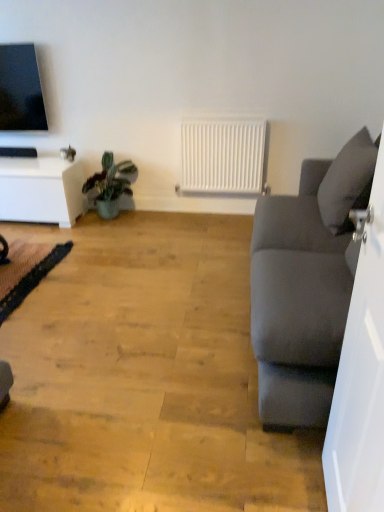
What do you see at coordinates (41, 190) in the screenshot?
I see `white glossy table at left` at bounding box center [41, 190].

What do you see at coordinates (348, 182) in the screenshot? This screenshot has height=512, width=384. I see `gray fabric pillow at right` at bounding box center [348, 182].

What do you see at coordinates (26, 271) in the screenshot? I see `black lace yoga mat at lower left` at bounding box center [26, 271].

Image resolution: width=384 pixels, height=512 pixels. What do you see at coordinates (305, 285) in the screenshot?
I see `matte gray couch at right` at bounding box center [305, 285].

Locate an element on the screen. white glossy table at left is located at coordinates (41, 190).

From the image's perspective, between white matte radiator at center and gray fabric pillow at right, which one is located above?

white matte radiator at center is shown above in the image.

Is gray fabric pillow at right inside white matte radiator at center?

No, gray fabric pillow at right is not inside white matte radiator at center.

From a real-world perspective, who is located lower, white matte radiator at center or gray fabric pillow at right?

From a 3D spatial view, white matte radiator at center is below.

Where is `radiator located behind the gray fabric pillow at right`? radiator located behind the gray fabric pillow at right is located at coordinates tap(223, 156).

Which object is wider, white glossy table at left or matte gray couch at right?

matte gray couch at right is wider.

There is a white glossy table at left. Where is `studio couch above it (from a real-world perspective)`? This screenshot has height=512, width=384. studio couch above it (from a real-world perspective) is located at coordinates (305, 285).

From a real-world perspective, which is physically above, white glossy table at left or matte gray couch at right?

matte gray couch at right is physically above.

Which object is further away from the camera, black lace yoga mat at lower left or white glossy table at left?

white glossy table at left is further from the camera.

Is black lace yoga mat at lower left positioned with its back to white glossy table at left?

No, black lace yoga mat at lower left is not facing away from white glossy table at left.

Is black lace yoga mat at lower left not within white glossy table at left?

Absolutely, black lace yoga mat at lower left is external to white glossy table at left.

Does matte gray couch at right have a lesser width compared to white glossy table at left?

In fact, matte gray couch at right might be wider than white glossy table at left.

Can you confirm if matte gray couch at right is shorter than white glossy table at left?

No, matte gray couch at right is not shorter than white glossy table at left.

Is matte gray couch at right looking in the opposite direction of white glossy table at left?

No.

From the image's perspective, which one is positioned lower, black lace yoga mat at lower left or matte gray couch at right?

black lace yoga mat at lower left.

This screenshot has height=512, width=384. What are the coordinates of `yoga mat to the left of matte gray couch at right` in the screenshot? It's located at (26, 271).

From a real-world perspective, relative to matte gray couch at right, is black lace yoga mat at lower left vertically above or below?

black lace yoga mat at lower left is below matte gray couch at right.

Between black lace yoga mat at lower left and matte gray couch at right, which one has more height?

matte gray couch at right is taller.

Is point (354, 164) positioned in front of point (51, 157)?

Yes, it is.

From the image's perspective, which object appears higher, gray fabric pillow at right or white glossy table at left?

white glossy table at left, from the image's perspective.

Is gray fabric pillow at right not within white glossy table at left?

Yes, gray fabric pillow at right is outside of white glossy table at left.

The image size is (384, 512). I want to click on pillow in front of the white glossy table at left, so click(348, 182).

Image resolution: width=384 pixels, height=512 pixels. I want to click on pillow positioned vertically above the black lace yoga mat at lower left (from a real-world perspective), so click(348, 182).

From a real-world perspective, does black lace yoga mat at lower left sit lower than gray fabric pillow at right?

Correct, in the physical world, black lace yoga mat at lower left is lower than gray fabric pillow at right.

Can you confirm if black lace yoga mat at lower left is shorter than gray fabric pillow at right?

Correct, black lace yoga mat at lower left is not as tall as gray fabric pillow at right.

Is black lace yoga mat at lower left directly adjacent to gray fabric pillow at right?

black lace yoga mat at lower left and gray fabric pillow at right are clearly separated.

Find the location of a particular element. The image size is (384, 512). pillow above the white matte radiator at center (from a real-world perspective) is located at coordinates (348, 182).

This screenshot has height=512, width=384. I want to click on table that is under the matte gray couch at right (from a real-world perspective), so click(41, 190).

Based on their spatial positions, is white matte radiator at center or matte gray couch at right further from black lace yoga mat at lower left?

matte gray couch at right.

Consider the image. When comparing their distances from white matte radiator at center, does matte gray couch at right or gray fabric pillow at right seem further?

gray fabric pillow at right lies further to white matte radiator at center than the other object.

Estimate the real-world distances between objects in this image. Which object is closer to white glossy table at left, black lace yoga mat at lower left or white matte radiator at center?

black lace yoga mat at lower left.

Based on their spatial positions, is green matte plant at lower left or matte gray couch at right closer to white glossy table at left?

green matte plant at lower left is positioned closer to the anchor white glossy table at left.

Estimate the real-world distances between objects in this image. Which object is closer to gray fabric pillow at right, white glossy table at left or black lace yoga mat at lower left?

Based on the image, black lace yoga mat at lower left appears to be nearer to gray fabric pillow at right.

Looking at the image, which one is located closer to matte gray couch at right, white glossy table at left or gray fabric pillow at right?

Among the two, gray fabric pillow at right is located nearer to matte gray couch at right.

From the image, which object appears to be farther from white glossy table at left, black lace yoga mat at lower left or green matte plant at lower left?

black lace yoga mat at lower left is positioned further to the anchor white glossy table at left.

Based on their spatial positions, is white matte radiator at center or white glossy table at left further from gray fabric pillow at right?

white glossy table at left is further to gray fabric pillow at right.

Locate an element on the screen. The height and width of the screenshot is (512, 384). yoga mat between white glossy table at left and white matte radiator at center is located at coordinates [x=26, y=271].

At what (x,y) coordinates should I click in order to perform the action: click on table between matte gray couch at right and white matte radiator at center along the z-axis. Please return your answer as a coordinate pair (x, y). This screenshot has width=384, height=512. Looking at the image, I should click on (41, 190).

Image resolution: width=384 pixels, height=512 pixels. I want to click on radiator between green matte plant at lower left and gray fabric pillow at right, so click(x=223, y=156).

You are a GUI agent. You are given a task and a screenshot of the screen. Output one action in this format:
    pyautogui.click(x=<x>, y=<y>)
    Task: Click on the houseplant located between black lace yoga mat at lower left and gray fabric pillow at right in the left-right direction
    The height and width of the screenshot is (512, 384).
    Given the screenshot: What is the action you would take?
    pyautogui.click(x=109, y=185)